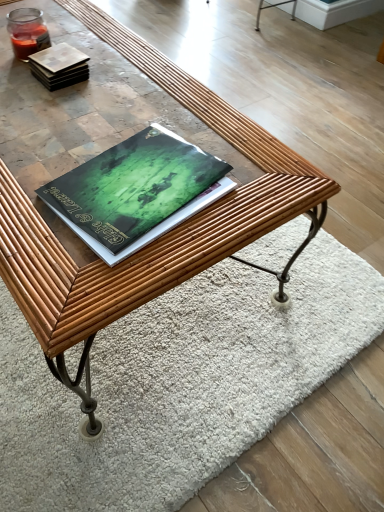
Question: Does green matte book at center, which is counted as the first book, starting from the front, lie behind matte brown tile at upper left, arranged as the 2th book when viewed from the front?

Choices:
 (A) no
 (B) yes

Answer: (A)

Question: From a real-world perspective, does green matte book at center, acting as the second book starting from the back, stand above matte brown tile at upper left, arranged as the 1th book when viewed from the back?

Choices:
 (A) yes
 (B) no

Answer: (B)

Question: From a real-world perspective, is green matte book at center, acting as the second book starting from the back, physically below matte brown tile at upper left, marked as the first book in a top-to-bottom arrangement?

Choices:
 (A) yes
 (B) no

Answer: (A)

Question: Would you say green matte book at center, the 2th book viewed from the top, contains matte brown tile at upper left, arranged as the 2th book when viewed from the front?

Choices:
 (A) no
 (B) yes

Answer: (A)

Question: From the image's perspective, is green matte book at center, the 2th book viewed from the top, on top of matte brown tile at upper left, marked as the first book in a top-to-bottom arrangement?

Choices:
 (A) no
 (B) yes

Answer: (A)

Question: Is green matte book at center, the 1th book ordered from the bottom, to the left of matte brown tile at upper left, marked as the first book in a top-to-bottom arrangement, from the viewer's perspective?

Choices:
 (A) no
 (B) yes

Answer: (A)

Question: Can you confirm if rug at center is smaller than matte brown tile at upper left, arranged as the 1th book when viewed from the back?

Choices:
 (A) yes
 (B) no

Answer: (B)

Question: Can you see rug at center touching matte brown tile at upper left, arranged as the 2th book when viewed from the front?

Choices:
 (A) yes
 (B) no

Answer: (B)

Question: Is rug at center closer to camera compared to matte brown tile at upper left, arranged as the 1th book when viewed from the back?

Choices:
 (A) no
 (B) yes

Answer: (B)

Question: Considering the relative sizes of rug at center and matte brown tile at upper left, arranged as the 1th book when viewed from the back, in the image provided, is rug at center taller than matte brown tile at upper left, arranged as the 1th book when viewed from the back,?

Choices:
 (A) yes
 (B) no

Answer: (B)

Question: From a real-world perspective, is rug at center physically below matte brown tile at upper left, marked as the first book in a top-to-bottom arrangement?

Choices:
 (A) yes
 (B) no

Answer: (A)

Question: Considering the relative sizes of rug at center and matte brown tile at upper left, marked as the first book in a top-to-bottom arrangement, in the image provided, is rug at center wider than matte brown tile at upper left, marked as the first book in a top-to-bottom arrangement,?

Choices:
 (A) no
 (B) yes

Answer: (B)

Question: Considering the relative sizes of green matte book at center, which is counted as the first book, starting from the front, and rug at center in the image provided, is green matte book at center, which is counted as the first book, starting from the front, taller than rug at center?

Choices:
 (A) no
 (B) yes

Answer: (A)